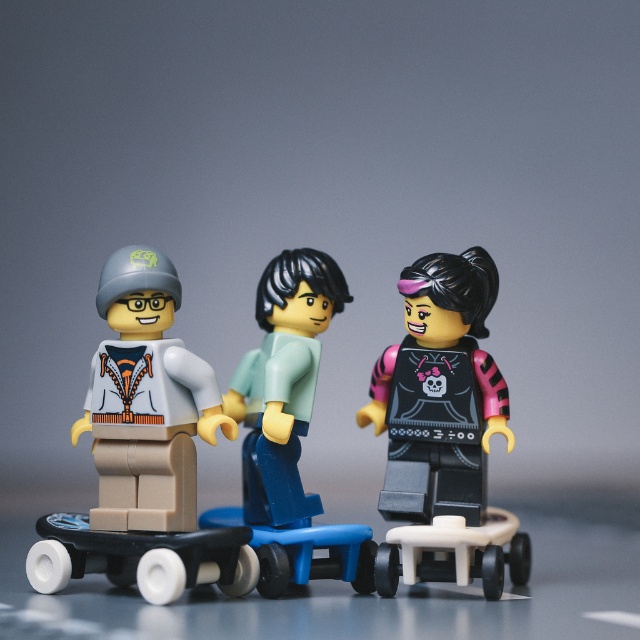
Question: Which object is positioned closest to the light blue plastic figure at center?

Choices:
 (A) matte black skateboard at center
 (B) white plastic skateboard at lower right

Answer: (A)

Question: Which object is farther from the camera taking this photo?

Choices:
 (A) matte black skateboard at center
 (B) light blue plastic figure at center

Answer: (B)

Question: Is light blue plastic figure at center positioned in front of white plastic skateboard at lower right?

Choices:
 (A) yes
 (B) no

Answer: (B)

Question: Which of the following is the farthest from the observer?

Choices:
 (A) (301, 282)
 (B) (417, 282)
 (C) (164, 256)
 (D) (442, 525)

Answer: (A)

Question: Does matte white jacket at center appear on the right side of light blue plastic figure at center?

Choices:
 (A) yes
 (B) no

Answer: (B)

Question: Does matte white jacket at center have a lesser width compared to white plastic skateboard at lower right?

Choices:
 (A) no
 (B) yes

Answer: (A)